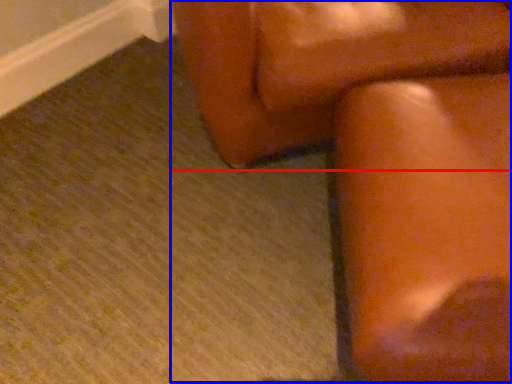
Question: Which point is closer to the camera, furniture (highlighted by a red box) or rocking chair (highlighted by a blue box)?

Choices:
 (A) furniture
 (B) rocking chair

Answer: (B)